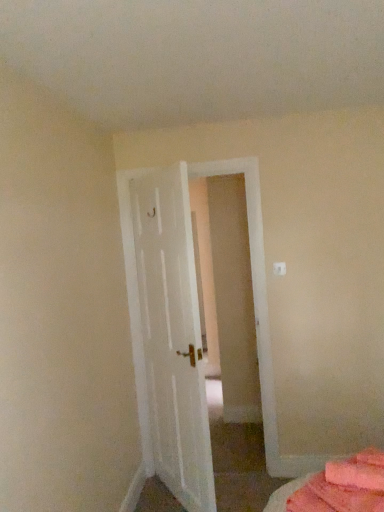
Question: Considering the positions of white painted wood door at center and pink fabric bed at lower right in the image, is white painted wood door at center bigger or smaller than pink fabric bed at lower right?

Choices:
 (A) small
 (B) big

Answer: (B)

Question: From the image's perspective, relative to pink fabric bed at lower right, is white painted wood door at center above or below?

Choices:
 (A) below
 (B) above

Answer: (B)

Question: Visually, is white painted wood door at center positioned to the left or to the right of pink fabric bed at lower right?

Choices:
 (A) left
 (B) right

Answer: (A)

Question: Is point (332, 492) positioned closer to the camera than point (119, 198)?

Choices:
 (A) farther
 (B) closer

Answer: (B)

Question: Is pink fabric bed at lower right wider or thinner than white painted wood door at center?

Choices:
 (A) thin
 (B) wide

Answer: (B)

Question: Would you say pink fabric bed at lower right is to the left or to the right of white painted wood door at center in the picture?

Choices:
 (A) left
 (B) right

Answer: (B)

Question: Would you say pink fabric bed at lower right is inside or outside white painted wood door at center?

Choices:
 (A) outside
 (B) inside

Answer: (A)